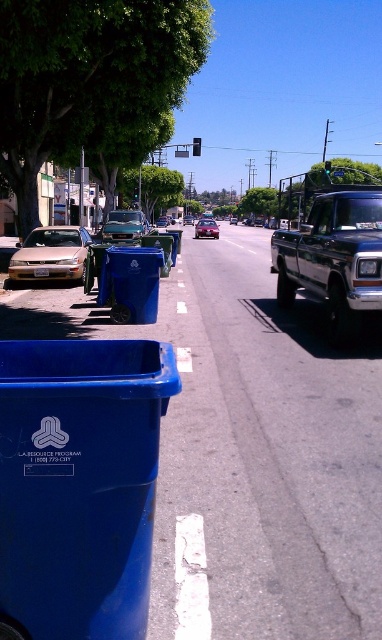
Question: Does metallic blue truck at right appear on the right side of blue plastic recycling bin at center?

Choices:
 (A) yes
 (B) no

Answer: (A)

Question: Observing the image, what is the correct spatial positioning of blue plastic recycling bin at center in reference to metallic red car at center?

Choices:
 (A) right
 (B) left

Answer: (B)

Question: Is blue plastic recycling bin at lower left thinner than metallic blue truck at right?

Choices:
 (A) yes
 (B) no

Answer: (A)

Question: Which point is closer to the camera taking this photo?

Choices:
 (A) (150, 257)
 (B) (124, 221)
 (C) (343, 225)

Answer: (C)

Question: Which is farther from the metallic blue truck at right?

Choices:
 (A) metallic silver car at center
 (B) blue plastic recycling bin at lower left
 (C) blue plastic recycling bin at center
 (D) metallic red car at center

Answer: (D)

Question: Among these points, which one is nearest to the camera?

Choices:
 (A) (119, 241)
 (B) (218, 227)

Answer: (A)